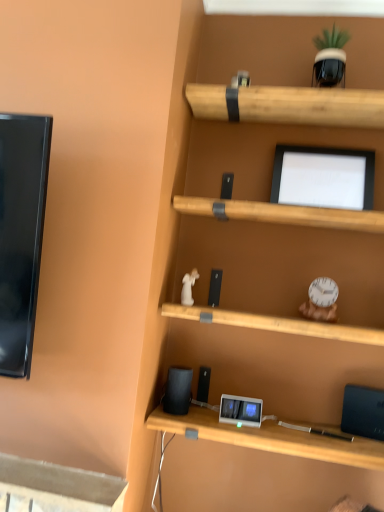
Question: From their relative heights in the image, would you say black matte speaker at lower center is taller or shorter than black matte computer monitor at upper center?

Choices:
 (A) tall
 (B) short

Answer: (B)

Question: Is black matte speaker at lower center in front of or behind black matte computer monitor at upper center in the image?

Choices:
 (A) front
 (B) behind

Answer: (A)

Question: Based on their sizes in the image, would you say black matte speaker at lower center is bigger or smaller than black matte computer monitor at upper center?

Choices:
 (A) big
 (B) small

Answer: (B)

Question: From the image's perspective, relative to black matte speaker at lower center, is black matte computer monitor at upper center above or below?

Choices:
 (A) below
 (B) above

Answer: (B)

Question: In the image, is black matte computer monitor at upper center positioned in front of or behind black matte speaker at lower center?

Choices:
 (A) behind
 (B) front

Answer: (A)

Question: Is black matte computer monitor at upper center spatially inside black matte speaker at lower center, or outside of it?

Choices:
 (A) inside
 (B) outside

Answer: (B)

Question: Is black matte computer monitor at upper center to the left or to the right of black matte speaker at lower center in the image?

Choices:
 (A) left
 (B) right

Answer: (B)